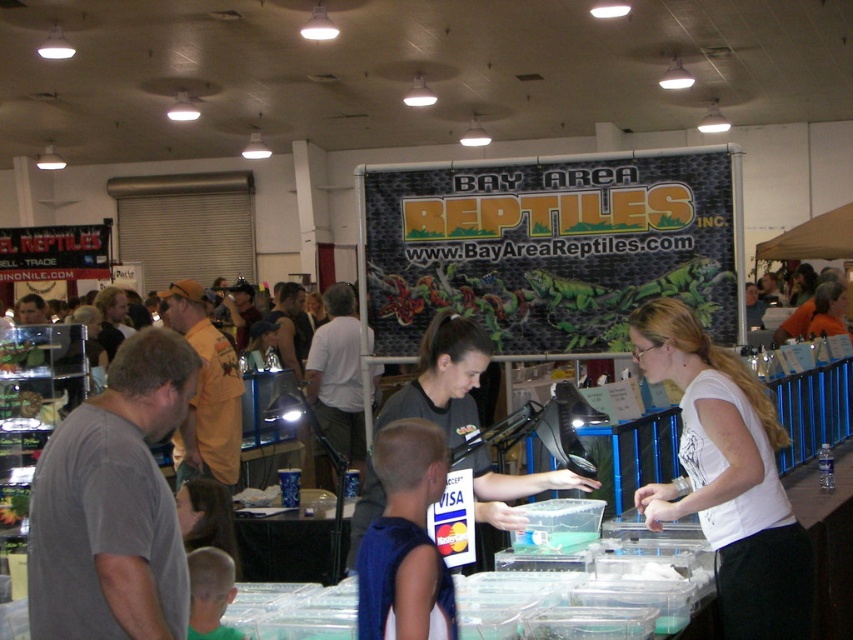
Question: Is white matte shirt at center thinner than dark gray shirt at center?

Choices:
 (A) no
 (B) yes

Answer: (B)

Question: Which object appears closest to the camera in this image?

Choices:
 (A) dark gray shirt at center
 (B) white matte shirt at center

Answer: (B)

Question: Which of the following is the closest to the observer?

Choices:
 (A) (584, 481)
 (B) (704, 371)

Answer: (B)

Question: Is white matte shirt at center positioned before dark gray shirt at center?

Choices:
 (A) yes
 (B) no

Answer: (A)

Question: Does white matte shirt at center have a smaller size compared to dark gray shirt at center?

Choices:
 (A) no
 (B) yes

Answer: (B)